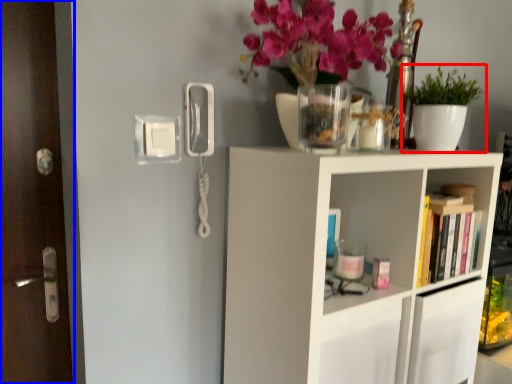
Question: Which object appears closest to the camera in this image, houseplant (highlighted by a red box) or door (highlighted by a blue box)?

Choices:
 (A) houseplant
 (B) door

Answer: (B)